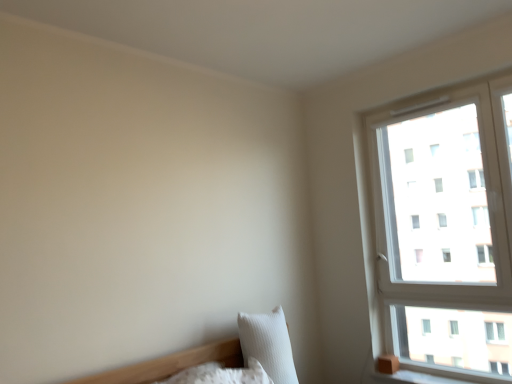
Question: Considering their positions, is white textured pillow at lower right, arranged as the 1th pillow when viewed from the right, located in front of or behind white soft pillow at lower left, arranged as the first pillow when viewed from the left?

Choices:
 (A) front
 (B) behind

Answer: (B)

Question: From their relative heights in the image, would you say white textured pillow at lower right, arranged as the 1th pillow when viewed from the right, is taller or shorter than white soft pillow at lower left, arranged as the first pillow when viewed from the left?

Choices:
 (A) tall
 (B) short

Answer: (A)

Question: Which of these objects is positioned farthest from the white plastic window at upper right?

Choices:
 (A) white textured pillow at lower right, positioned as the second pillow in left-to-right order
 (B) white soft pillow at lower left, which is the 2th pillow in right-to-left order

Answer: (B)

Question: Estimate the real-world distances between objects in this image. Which object is farther from the white plastic window at upper right?

Choices:
 (A) white textured pillow at lower right, positioned as the second pillow in left-to-right order
 (B) white soft pillow at lower left, which is the 2th pillow in right-to-left order

Answer: (B)